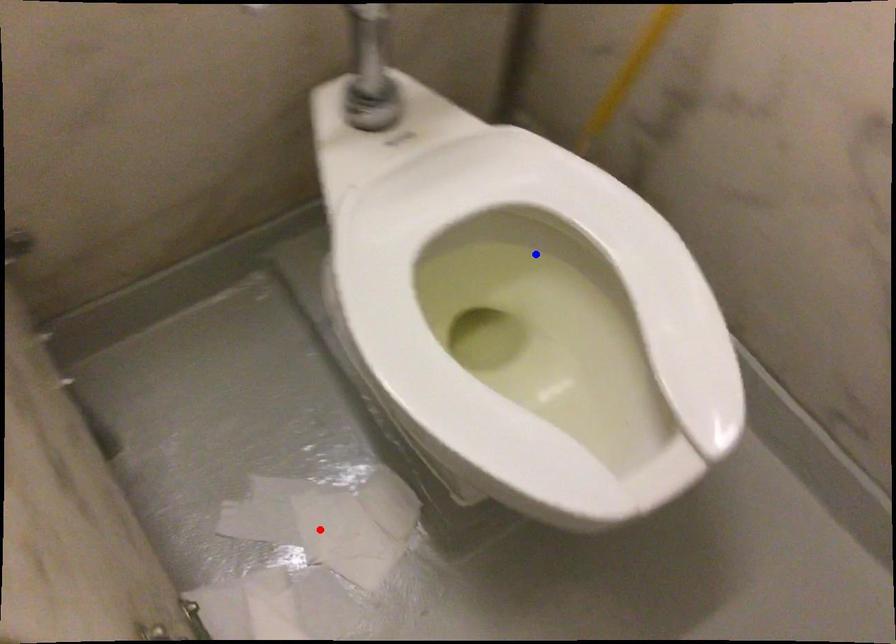
Question: Which of the two points in the image is closer to the camera?

Choices:
 (A) Blue point is closer.
 (B) Red point is closer.

Answer: (A)